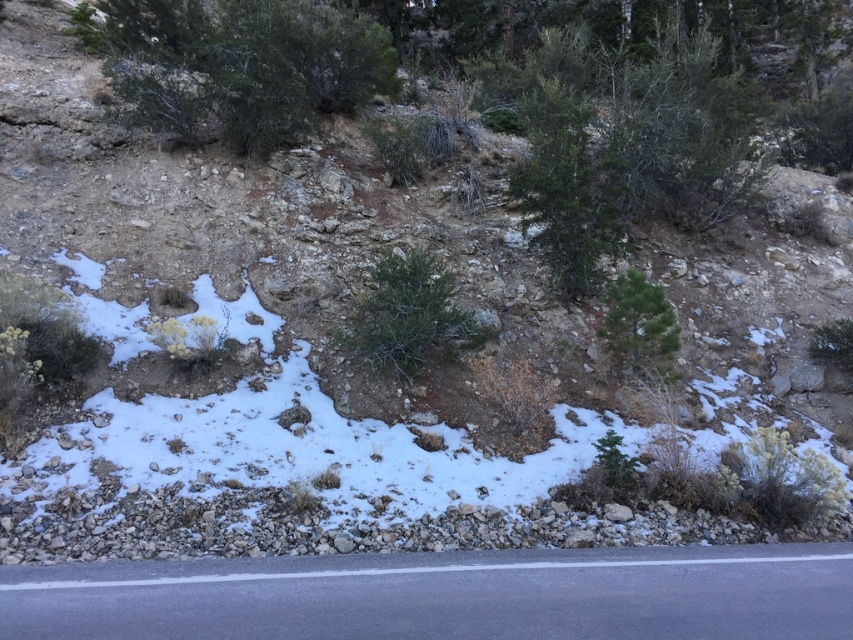
Does point (440, 611) come in front of point (183, 4)?

Yes, it is in front of point (183, 4).

Does asphalt at lower center appear on the left side of green leafy bush at upper left?

In fact, asphalt at lower center is to the right of green leafy bush at upper left.

Locate an element on the screen. asphalt at lower center is located at coordinates (445, 595).

Is green leafy bush at upper left taller than green leafy tree at upper center?

In fact, green leafy bush at upper left may be shorter than green leafy tree at upper center.

Does green leafy bush at upper left have a lesser height compared to green leafy tree at upper center?

Yes.

The height and width of the screenshot is (640, 853). Describe the element at coordinates (242, 64) in the screenshot. I see `green leafy bush at upper left` at that location.

Where is `green leafy bush at upper left`? green leafy bush at upper left is located at coordinates (242, 64).

Is asphalt at lower center taller than green needle-like at center?

Incorrect, asphalt at lower center's height is not larger of green needle-like at center's.

Does asphalt at lower center have a larger size compared to green needle-like at center?

Actually, asphalt at lower center might be smaller than green needle-like at center.

Between point (167, 589) and point (648, 376), which one is positioned behind?

The point (648, 376) is behind.

This screenshot has height=640, width=853. What are the coordinates of `asphalt at lower center` in the screenshot? It's located at (445, 595).